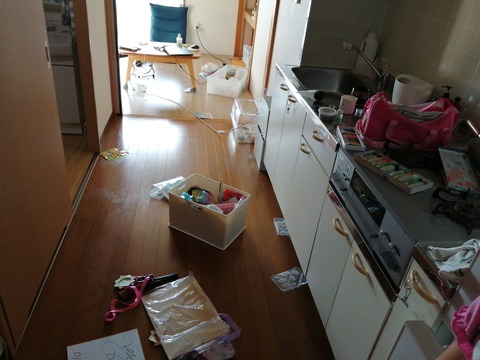
Locate an element on the screen. The width and height of the screenshot is (480, 360). box is located at coordinates (210, 231).